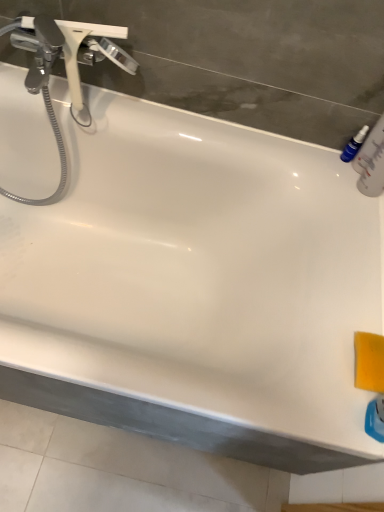
Question: Is blue plastic bottle at upper right inside or outside of chrome metallic faucet at upper left?

Choices:
 (A) inside
 (B) outside

Answer: (B)

Question: Looking at their shapes, would you say blue plastic bottle at upper right is wider or thinner than chrome metallic faucet at upper left?

Choices:
 (A) thin
 (B) wide

Answer: (A)

Question: From the image's perspective, is blue plastic bottle at upper right above or below chrome metallic faucet at upper left?

Choices:
 (A) below
 (B) above

Answer: (A)

Question: Looking at the image, does chrome metallic faucet at upper left seem bigger or smaller compared to blue plastic bottle at upper right?

Choices:
 (A) small
 (B) big

Answer: (B)

Question: From a real-world perspective, relative to blue plastic bottle at upper right, is chrome metallic faucet at upper left vertically above or below?

Choices:
 (A) below
 (B) above

Answer: (B)

Question: In the image, is chrome metallic faucet at upper left positioned in front of or behind blue plastic bottle at upper right?

Choices:
 (A) front
 (B) behind

Answer: (A)

Question: Would you say chrome metallic faucet at upper left is to the left or to the right of blue plastic bottle at upper right in the picture?

Choices:
 (A) right
 (B) left

Answer: (B)